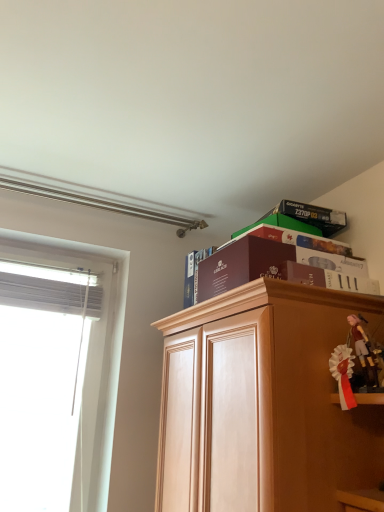
Question: Does matte black box at upper right have a greater height compared to white sheer curtain at left?

Choices:
 (A) no
 (B) yes

Answer: (A)

Question: Would you say matte black box at upper right is outside white sheer curtain at left?

Choices:
 (A) no
 (B) yes

Answer: (B)

Question: Does matte black box at upper right have a larger size compared to white sheer curtain at left?

Choices:
 (A) no
 (B) yes

Answer: (B)

Question: From a real-world perspective, is matte black box at upper right below white sheer curtain at left?

Choices:
 (A) no
 (B) yes

Answer: (A)

Question: Does matte black box at upper right contain white sheer curtain at left?

Choices:
 (A) no
 (B) yes

Answer: (A)

Question: Considering the relative positions of matte black box at upper right and white sheer curtain at left in the image provided, is matte black box at upper right to the left of white sheer curtain at left from the viewer's perspective?

Choices:
 (A) no
 (B) yes

Answer: (A)

Question: Is light brown wood cabinet at upper right located outside white sheer curtain at left?

Choices:
 (A) no
 (B) yes

Answer: (B)

Question: Is light brown wood cabinet at upper right wider than white sheer curtain at left?

Choices:
 (A) no
 (B) yes

Answer: (B)

Question: Is light brown wood cabinet at upper right bigger than white sheer curtain at left?

Choices:
 (A) no
 (B) yes

Answer: (B)

Question: Can you confirm if light brown wood cabinet at upper right is smaller than white sheer curtain at left?

Choices:
 (A) no
 (B) yes

Answer: (A)

Question: Is light brown wood cabinet at upper right shorter than white sheer curtain at left?

Choices:
 (A) no
 (B) yes

Answer: (A)

Question: Is light brown wood cabinet at upper right at the left side of white sheer curtain at left?

Choices:
 (A) no
 (B) yes

Answer: (A)

Question: Is white satin ribbon at right, marked as the 1th toy in a left-to-right arrangement, facing away from matte black box at upper right?

Choices:
 (A) yes
 (B) no

Answer: (B)